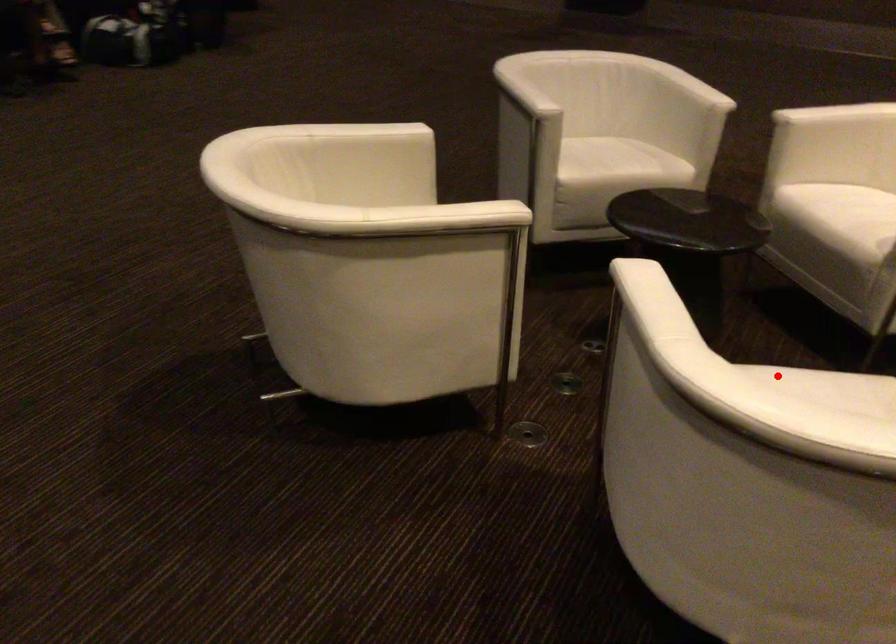
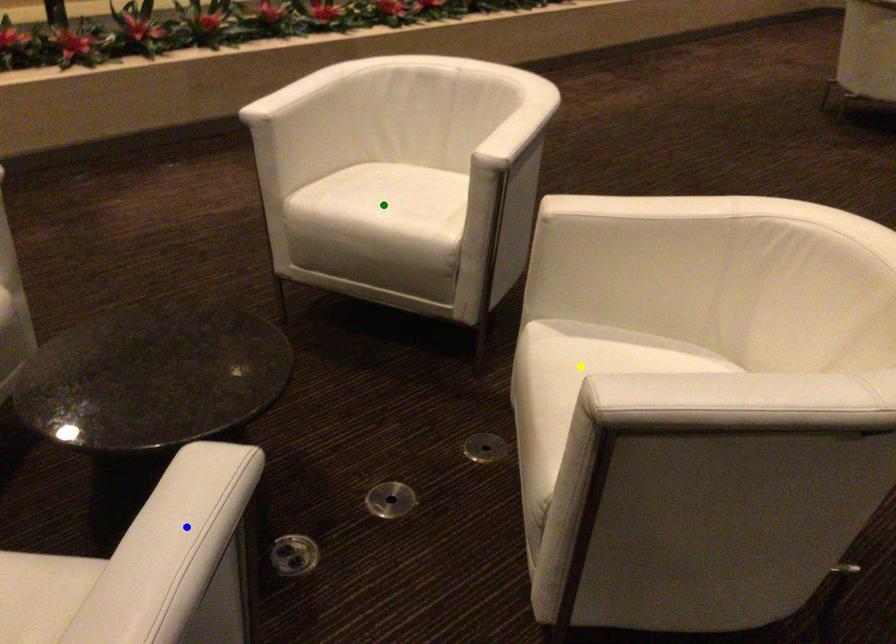
Question: I am providing you with two images of the same scene from different viewpoints. A red point is marked on the first image. You are given multiple points on the second image. Which spot in image 2 lines up with the point in image 1?

Choices:
 (A) green point
 (B) yellow point
 (C) blue point

Answer: (A)